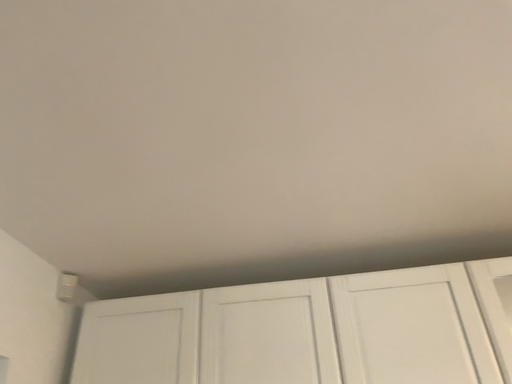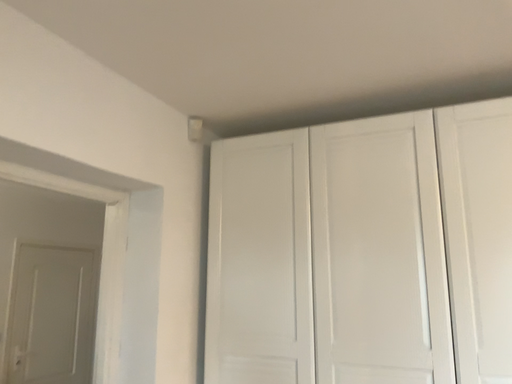
Question: How did the camera likely rotate when shooting the video?

Choices:
 (A) rotated left
 (B) rotated right

Answer: (A)